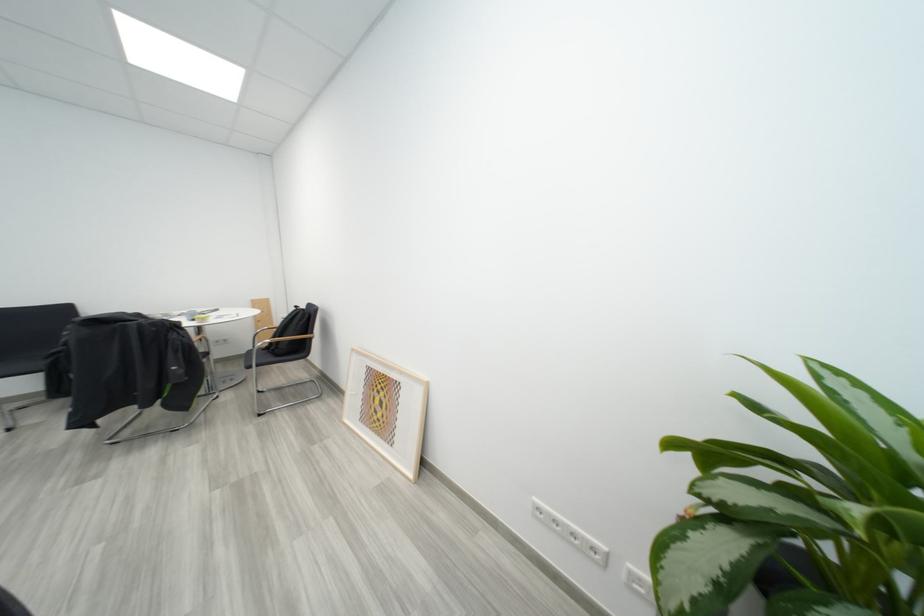
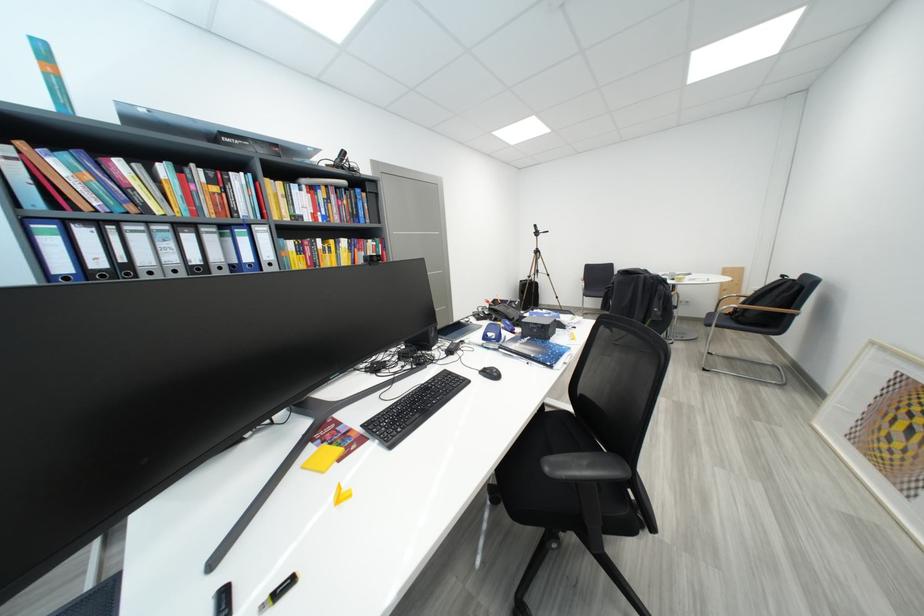
The point at (286, 358) is marked in the first image. Where is the corresponding point in the second image?

(748, 325)